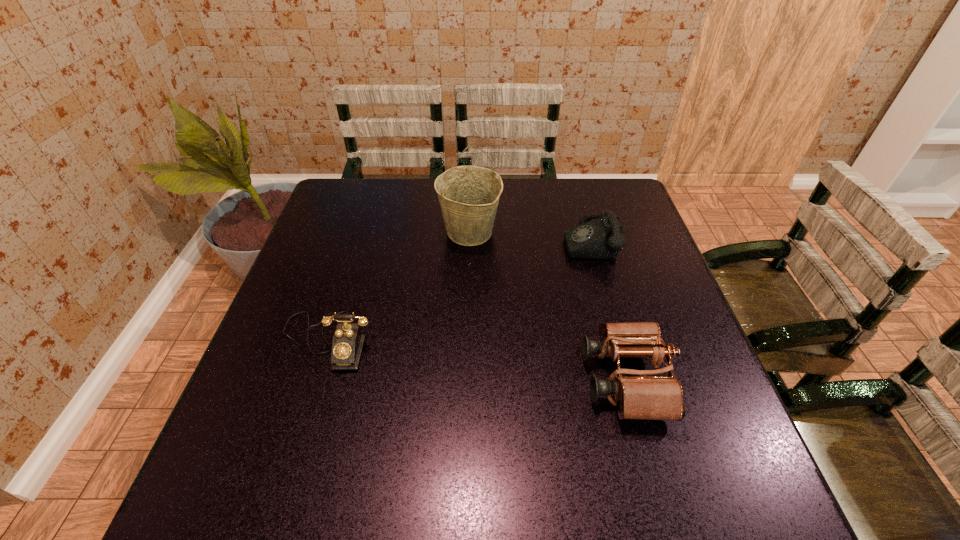
Find the location of a particular element. wine bucket is located at coordinates (469, 195).

At what (x,y) coordinates should I click in order to perform the action: click on the tallest object. Please return your answer as a coordinate pair (x, y). Looking at the image, I should click on (469, 195).

Where is `binoculars`? This screenshot has width=960, height=540. binoculars is located at coordinates (640, 394).

The image size is (960, 540). In order to click on the leftmost object in this screenshot , I will do `click(347, 344)`.

Image resolution: width=960 pixels, height=540 pixels. Identify the location of the left telephone. (347, 344).

The image size is (960, 540). In order to click on the right telephone in this screenshot , I will do `click(601, 238)`.

You are a GUI agent. You are given a task and a screenshot of the screen. Output one action in this format:
    pyautogui.click(x=<x>, y=<y>)
    Task: Click on the free spot located on the right of the tallest object
    Image resolution: width=960 pixels, height=540 pixels.
    Given the screenshot: What is the action you would take?
    pyautogui.click(x=608, y=232)

Where is `vacant space located 0.290m through the eyepieces of the binoculars`? The height and width of the screenshot is (540, 960). vacant space located 0.290m through the eyepieces of the binoculars is located at coordinates (447, 379).

Where is `free region located through the eyepieces of the binoculars`? This screenshot has width=960, height=540. free region located through the eyepieces of the binoculars is located at coordinates (423, 379).

Locate an element on the screen. vacant space positioned through the eyepieces of the binoculars is located at coordinates (499, 379).